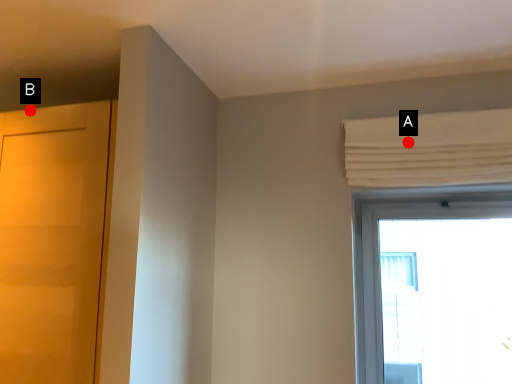
Question: Two points are circled on the image, labeled by A and B beside each circle. Which point is closer to the camera?

Choices:
 (A) A is closer
 (B) B is closer

Answer: (B)